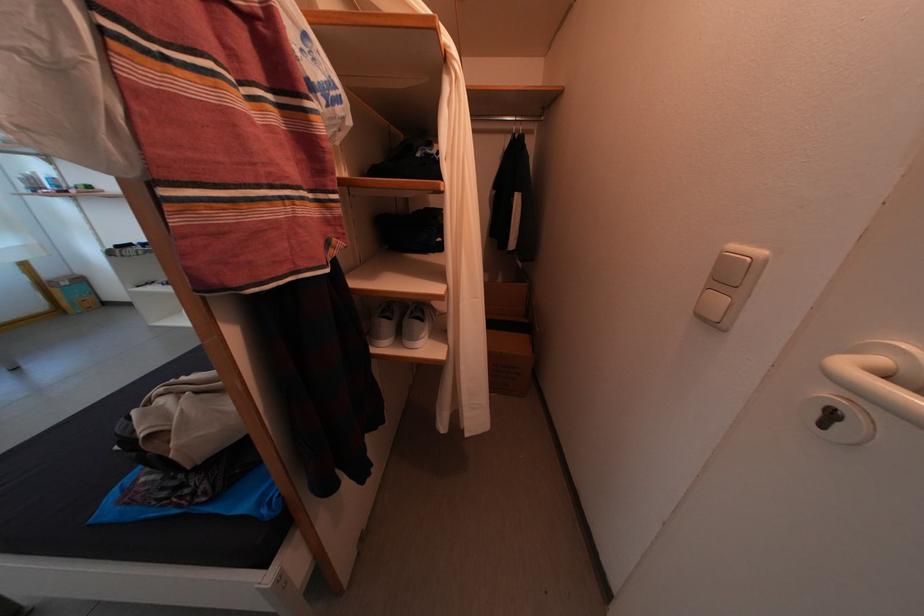
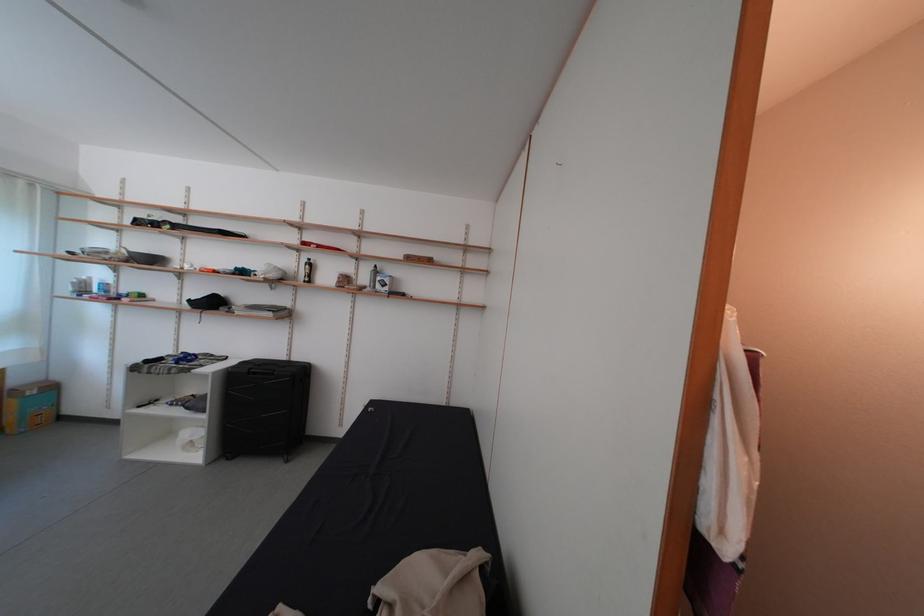
Question: What movement of the cameraman would produce the second image?

Choices:
 (A) Left
 (B) Right
 (C) Forward
 (D) Backward

Answer: (A)